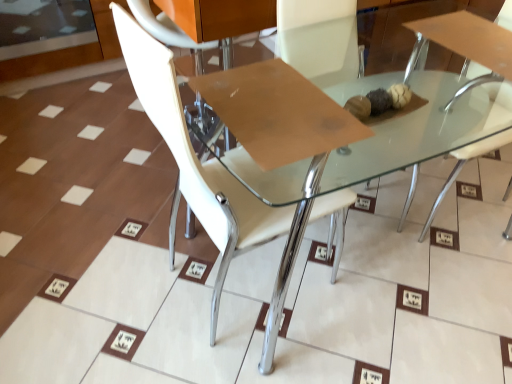
Question: Considering the relative sizes of brown matte cardboard at center and clear glass table at center in the image provided, is brown matte cardboard at center taller than clear glass table at center?

Choices:
 (A) yes
 (B) no

Answer: (B)

Question: From the image's perspective, is brown matte cardboard at center on top of clear glass table at center?

Choices:
 (A) no
 (B) yes

Answer: (B)

Question: From the image's perspective, is brown matte cardboard at center under clear glass table at center?

Choices:
 (A) no
 (B) yes

Answer: (A)

Question: Is brown matte cardboard at center oriented away from clear glass table at center?

Choices:
 (A) yes
 (B) no

Answer: (A)

Question: From a real-world perspective, is brown matte cardboard at center located higher than clear glass table at center?

Choices:
 (A) yes
 (B) no

Answer: (A)

Question: Does brown matte cardboard at center turn towards clear glass table at center?

Choices:
 (A) yes
 (B) no

Answer: (A)

Question: Is white glossy chair at center, the 1th chair in the left-to-right sequence, next to brown matte cardboard at center and touching it?

Choices:
 (A) no
 (B) yes

Answer: (A)

Question: Does white glossy chair at center, the 1th chair in the left-to-right sequence, have a lesser height compared to brown matte cardboard at center?

Choices:
 (A) no
 (B) yes

Answer: (A)

Question: Is there a large distance between white glossy chair at center, which is the second chair in right-to-left order, and brown matte cardboard at center?

Choices:
 (A) yes
 (B) no

Answer: (B)

Question: From the image's perspective, does white glossy chair at center, the 1th chair in the left-to-right sequence, appear lower than brown matte cardboard at center?

Choices:
 (A) yes
 (B) no

Answer: (A)

Question: Does white glossy chair at center, which is the second chair in right-to-left order, have a greater height compared to brown matte cardboard at center?

Choices:
 (A) yes
 (B) no

Answer: (A)

Question: Could you tell me if white glossy chair at center, which is the second chair in right-to-left order, is turned towards brown matte cardboard at center?

Choices:
 (A) no
 (B) yes

Answer: (B)

Question: Does clear glass table at center have a lesser width compared to brown matte cardboard at center?

Choices:
 (A) no
 (B) yes

Answer: (A)